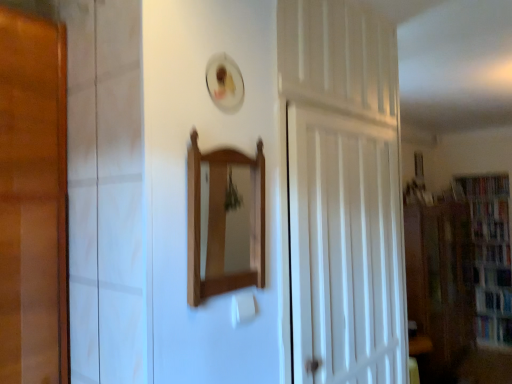
Image resolution: width=512 pixels, height=384 pixels. Find the location of `hardcover book at right, the 4th book ordered from the bottom`. hardcover book at right, the 4th book ordered from the bottom is located at coordinates (486, 185).

What do you see at coordinates (345, 250) in the screenshot? I see `white wooden door at center` at bounding box center [345, 250].

What is the approximate width of hardcover book at right, arranged as the 1th book when ordered from the bottom?

9.04 inches.

Where is `wooden bookcase at right`? This screenshot has height=384, width=512. wooden bookcase at right is located at coordinates (490, 254).

Where is `hardcover book at right, which is the 1th book from top to bottom`? The height and width of the screenshot is (384, 512). hardcover book at right, which is the 1th book from top to bottom is located at coordinates (486, 185).

Would you say white wooden door at center is a long distance from hardcover book at right, arranged as the 1th book when ordered from the bottom?

Yes, white wooden door at center and hardcover book at right, arranged as the 1th book when ordered from the bottom, are quite far apart.

Which is farther, [349,295] or [499,329]?

Positioned behind is point [499,329].

Would you say hardcover book at right, positioned as the fourth book in top-to-bottom order, is part of white wooden door at center's contents?

No, hardcover book at right, positioned as the fourth book in top-to-bottom order, is located outside of white wooden door at center.

From the image's perspective, is white wooden door at center located above or below hardcover book at right, arranged as the 1th book when ordered from the bottom?

white wooden door at center is above hardcover book at right, arranged as the 1th book when ordered from the bottom.

Is light brown wood mirror at center inside or outside of white wooden door at center?

light brown wood mirror at center is not inside white wooden door at center, it's outside.

Consider the image. Considering the relative sizes of light brown wood mirror at center and white wooden door at center in the image provided, is light brown wood mirror at center bigger than white wooden door at center?

Actually, light brown wood mirror at center might be smaller than white wooden door at center.

Is light brown wood mirror at center shorter than white wooden door at center?

Correct, light brown wood mirror at center is not as tall as white wooden door at center.

How many degrees apart are the facing directions of light brown wood mirror at center and white wooden door at center?

1.94 degrees.

Who is taller, hardcover book at right, arranged as the 1th book when ordered from the bottom, or hardcover book at right, marked as the second book in a top-to-bottom arrangement?

Standing taller between the two is hardcover book at right, arranged as the 1th book when ordered from the bottom.

Which object is further away from the camera, hardcover book at right, arranged as the 1th book when ordered from the bottom, or hardcover book at right, marked as the second book in a top-to-bottom arrangement?

hardcover book at right, marked as the second book in a top-to-bottom arrangement.

Is hardcover book at right, positioned as the fourth book in top-to-bottom order, surrounding hardcover book at right, which is counted as the third book, starting from the bottom?

No, hardcover book at right, which is counted as the third book, starting from the bottom, is not surrounded by hardcover book at right, positioned as the fourth book in top-to-bottom order.

Is hardcover book at right, arranged as the 1th book when ordered from the bottom, next to hardcover book at right, marked as the second book in a top-to-bottom arrangement?

hardcover book at right, arranged as the 1th book when ordered from the bottom, is not next to hardcover book at right, marked as the second book in a top-to-bottom arrangement, and they're not touching.

From the image's perspective, does hardcover book at right, which is counted as the third book, starting from the bottom, appear lower than light brown wood mirror at center?

Yes.

From a real-world perspective, relative to light brown wood mirror at center, is hardcover book at right, which is counted as the third book, starting from the bottom, vertically above or below?

From a real-world perspective, hardcover book at right, which is counted as the third book, starting from the bottom, is physically below light brown wood mirror at center.

Does hardcover book at right, which is counted as the third book, starting from the bottom, have a greater height compared to light brown wood mirror at center?

No, hardcover book at right, which is counted as the third book, starting from the bottom, is not taller than light brown wood mirror at center.

Find the location of `mirror lying on the left of hardcover book at right, acting as the second book starting from the bottom`. mirror lying on the left of hardcover book at right, acting as the second book starting from the bottom is located at coordinates (221, 222).

Are light brown wood mirror at center and hardcover book at right, the 3th book from the top, making contact?

light brown wood mirror at center and hardcover book at right, the 3th book from the top, are clearly separated.

Can you confirm if light brown wood mirror at center is wider than hardcover book at right, the 3th book from the top?

In fact, light brown wood mirror at center might be narrower than hardcover book at right, the 3th book from the top.

Does light brown wood mirror at center turn towards hardcover book at right, acting as the second book starting from the bottom?

No, light brown wood mirror at center is not turned towards hardcover book at right, acting as the second book starting from the bottom.

Considering the positions of points (487, 342) and (431, 298), is point (487, 342) closer to camera compared to point (431, 298)?

No.

From a real-world perspective, which is physically above, hardcover book at right, arranged as the 1th book when ordered from the bottom, or transparent glass cabinet at right?

transparent glass cabinet at right.

Which book is the 1st one when counting from the back of the transparent glass cabinet at right? Please provide its 2D coordinates.

[(494, 330)]

How much distance is there between hardcover book at right, arranged as the 1th book when ordered from the bottom, and transparent glass cabinet at right?

31.87 inches.

Which object is further away from the camera taking this photo, light brown wood mirror at center or wooden bookcase at right?

wooden bookcase at right is behind.

Does light brown wood mirror at center turn towards wooden bookcase at right?

No, light brown wood mirror at center is not oriented towards wooden bookcase at right.

From the image's perspective, is light brown wood mirror at center on wooden bookcase at right?

Correct, light brown wood mirror at center appears higher than wooden bookcase at right in the image.

The image size is (512, 384). In order to click on door in front of the hardcover book at right, positioned as the fourth book in top-to-bottom order in this screenshot , I will do `click(345, 250)`.

Image resolution: width=512 pixels, height=384 pixels. In order to click on mirror above the white wooden door at center (from the image's perspective) in this screenshot , I will do `click(221, 222)`.

Looking at the image, which one is located closer to transparent glass cabinet at right, white wooden door at center or wooden bookcase at right?

Among the two, wooden bookcase at right is located nearer to transparent glass cabinet at right.

Considering their positions, is hardcover book at right, the 4th book ordered from the bottom, positioned closer to wooden bookcase at right than light brown wood mirror at center?

hardcover book at right, the 4th book ordered from the bottom, is closer to wooden bookcase at right.

Estimate the real-world distances between objects in this image. Which object is closer to hardcover book at right, which is counted as the third book, starting from the bottom, hardcover book at right, the 4th book ordered from the bottom, or light brown wood mirror at center?

hardcover book at right, the 4th book ordered from the bottom, lies closer to hardcover book at right, which is counted as the third book, starting from the bottom, than the other object.

Looking at the image, which one is located further to white wooden door at center, hardcover book at right, which is the 1th book from top to bottom, or light brown wood mirror at center?

hardcover book at right, which is the 1th book from top to bottom, is further to white wooden door at center.

Estimate the real-world distances between objects in this image. Which object is further from light brown wood mirror at center, hardcover book at right, arranged as the 1th book when ordered from the bottom, or transparent glass cabinet at right?

hardcover book at right, arranged as the 1th book when ordered from the bottom, is further to light brown wood mirror at center.

From the image, which object appears to be farther from white wooden door at center, hardcover book at right, positioned as the fourth book in top-to-bottom order, or wooden bookcase at right?

The object further to white wooden door at center is hardcover book at right, positioned as the fourth book in top-to-bottom order.

From the image, which object appears to be farther from hardcover book at right, the 3th book from the top, light brown wood mirror at center or wooden bookcase at right?

The object further to hardcover book at right, the 3th book from the top, is light brown wood mirror at center.

When comparing their distances from hardcover book at right, the 4th book ordered from the bottom, does light brown wood mirror at center or transparent glass cabinet at right seem further?

Based on the image, light brown wood mirror at center appears to be further to hardcover book at right, the 4th book ordered from the bottom.

Find the location of a particular element. Image resolution: width=512 pixels, height=384 pixels. door positioned between light brown wood mirror at center and hardcover book at right, arranged as the 1th book when ordered from the bottom, from near to far is located at coordinates (345, 250).

Identify the location of book between hardcover book at right, which is counted as the third book, starting from the bottom, and hardcover book at right, positioned as the fourth book in top-to-bottom order, in the vertical direction. (494, 300).

What are the coordinates of `book located between light brown wood mirror at center and hardcover book at right, acting as the second book starting from the bottom, in the depth direction` in the screenshot? It's located at (494, 330).

You are a GUI agent. You are given a task and a screenshot of the screen. Output one action in this format:
    pyautogui.click(x=<x>, y=<y>)
    Task: Click on the bookcase located between white wooden door at center and hardcover book at right, acting as the second book starting from the bottom, in the depth direction
    
    Given the screenshot: What is the action you would take?
    pyautogui.click(x=490, y=254)